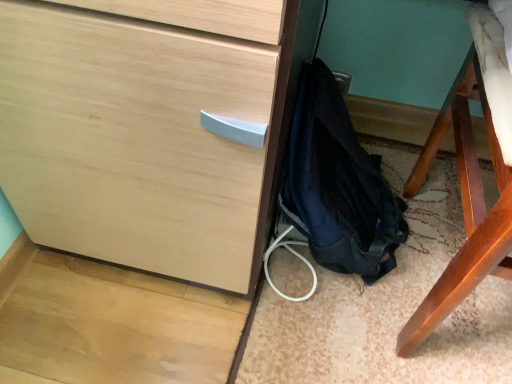
Question: Can you confirm if dark blue fabric backpack at lower right is taller than matte wood chest of drawers at center?

Choices:
 (A) yes
 (B) no

Answer: (B)

Question: Is dark blue fabric backpack at lower right directly adjacent to matte wood chest of drawers at center?

Choices:
 (A) no
 (B) yes

Answer: (A)

Question: Would you say dark blue fabric backpack at lower right is a long distance from matte wood chest of drawers at center?

Choices:
 (A) yes
 (B) no

Answer: (B)

Question: Considering the relative sizes of dark blue fabric backpack at lower right and matte wood chest of drawers at center in the image provided, is dark blue fabric backpack at lower right bigger than matte wood chest of drawers at center?

Choices:
 (A) yes
 (B) no

Answer: (B)

Question: Is dark blue fabric backpack at lower right at the left side of matte wood chest of drawers at center?

Choices:
 (A) no
 (B) yes

Answer: (B)

Question: Is dark blue fabric backpack at lower right to the right of matte wood chest of drawers at center from the viewer's perspective?

Choices:
 (A) no
 (B) yes

Answer: (A)

Question: Is matte wood chest of drawers at center further to the viewer compared to dark blue fabric backpack at lower right?

Choices:
 (A) yes
 (B) no

Answer: (B)

Question: Is matte wood chest of drawers at center positioned beyond the bounds of dark blue fabric backpack at lower right?

Choices:
 (A) yes
 (B) no

Answer: (A)

Question: From the image's perspective, does matte wood chest of drawers at center appear lower than dark blue fabric backpack at lower right?

Choices:
 (A) no
 (B) yes

Answer: (A)

Question: Considering the relative sizes of matte wood chest of drawers at center and dark blue fabric backpack at lower right in the image provided, is matte wood chest of drawers at center smaller than dark blue fabric backpack at lower right?

Choices:
 (A) no
 (B) yes

Answer: (A)

Question: Is matte wood chest of drawers at center to the left of dark blue fabric backpack at lower right from the viewer's perspective?

Choices:
 (A) no
 (B) yes

Answer: (A)

Question: Can you confirm if matte wood chest of drawers at center is taller than dark blue fabric backpack at lower right?

Choices:
 (A) yes
 (B) no

Answer: (A)

Question: Considering the positions of matte wood chest of drawers at center and dark blue fabric backpack at lower right in the image, is matte wood chest of drawers at center wider or thinner than dark blue fabric backpack at lower right?

Choices:
 (A) wide
 (B) thin

Answer: (A)